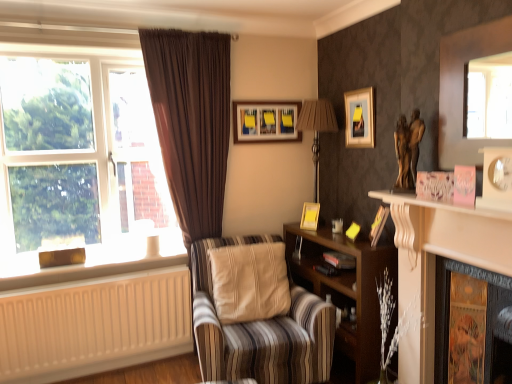
Question: Looking at their shapes, would you say white matte radiator at lower left is wider or thinner than black matte book at center?

Choices:
 (A) wide
 (B) thin

Answer: (B)

Question: Is white matte radiator at lower left situated inside black matte book at center or outside?

Choices:
 (A) outside
 (B) inside

Answer: (A)

Question: Which object is positioned farthest from the black matte book at center?

Choices:
 (A) beige painted wood at lower left
 (B) metallic silver table lamp at upper center
 (C) matte yellow picture frame at upper right, the second picture frame when ordered from front to back
 (D) white glossy fireplace at right, positioned as the 2th fireplace in right-to-left order
 (E) wooden picture frame at right, the 4th picture frame in the left-to-right sequence

Answer: (A)

Question: Estimate the real-world distances between objects in this image. Which object is closer to the gold textured fireplace at lower right, which ranks as the second fireplace in left-to-right order?

Choices:
 (A) black matte book at center
 (B) matte yellow picture frame at upper right, placed as the 3th picture frame when sorted from bottom to top
 (C) wooden picture frame at right, which is the fourth picture frame from top to bottom
 (D) metallic silver table lamp at upper center
 (E) brown fabric curtain at left

Answer: (C)